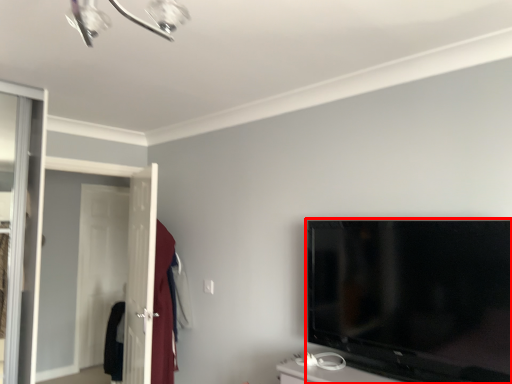
Question: Observing the image, what is the correct spatial positioning of television (annotated by the red box) in reference to screen door?

Choices:
 (A) left
 (B) right

Answer: (B)